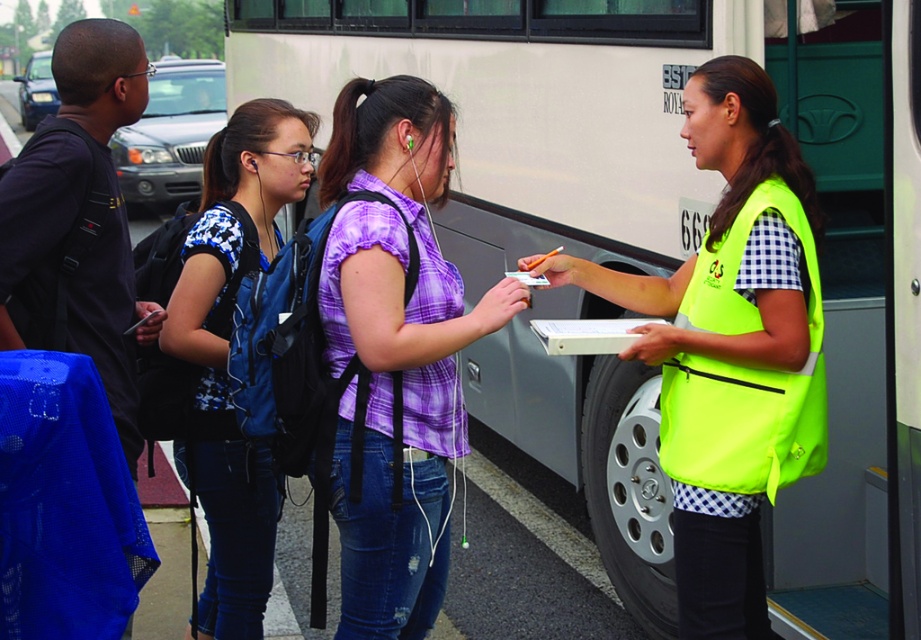
Who is lower down, neon yellow vest at center or blue printed shirt at center?

blue printed shirt at center is lower down.

Is point (542, 264) less distant than point (170, 340)?

Yes, it is in front of point (170, 340).

Image resolution: width=921 pixels, height=640 pixels. I want to click on neon yellow vest at center, so click(x=727, y=340).

Which is above, neon yellow vest at center or neon yellow fabric safety vest at right?

neon yellow fabric safety vest at right

Who is positioned more to the left, neon yellow vest at center or neon yellow fabric safety vest at right?

neon yellow vest at center

Locate an element on the screen. The height and width of the screenshot is (640, 921). neon yellow vest at center is located at coordinates (727, 340).

In order to click on neon yellow vest at center in this screenshot , I will do `click(727, 340)`.

Between point (423, 324) and point (201, 410), which one is positioned in front?

Point (423, 324) is more forward.

Is point (428, 148) positioned in front of point (255, 118)?

Yes, it is in front of point (255, 118).

Identify the location of purple plaid shirt at center. The image size is (921, 640). (395, 349).